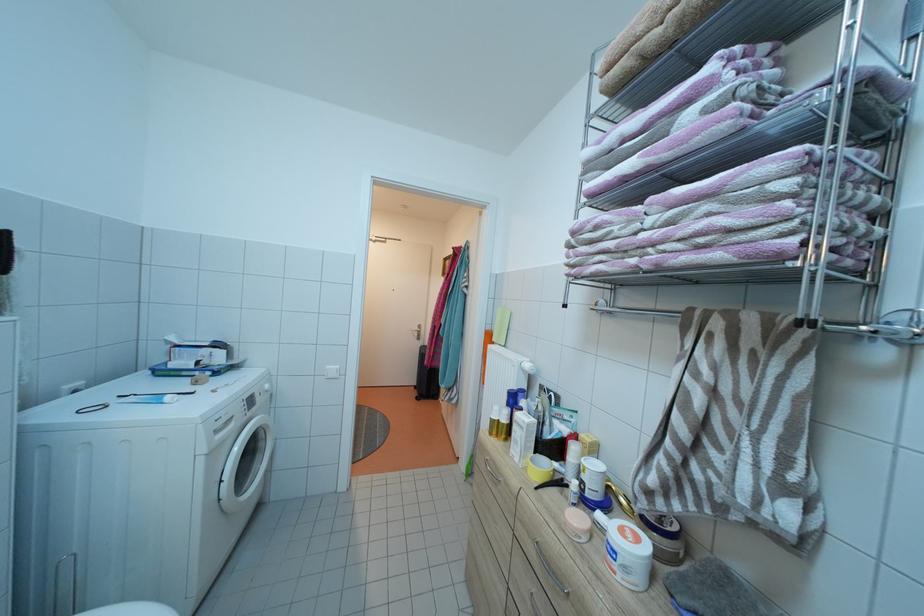
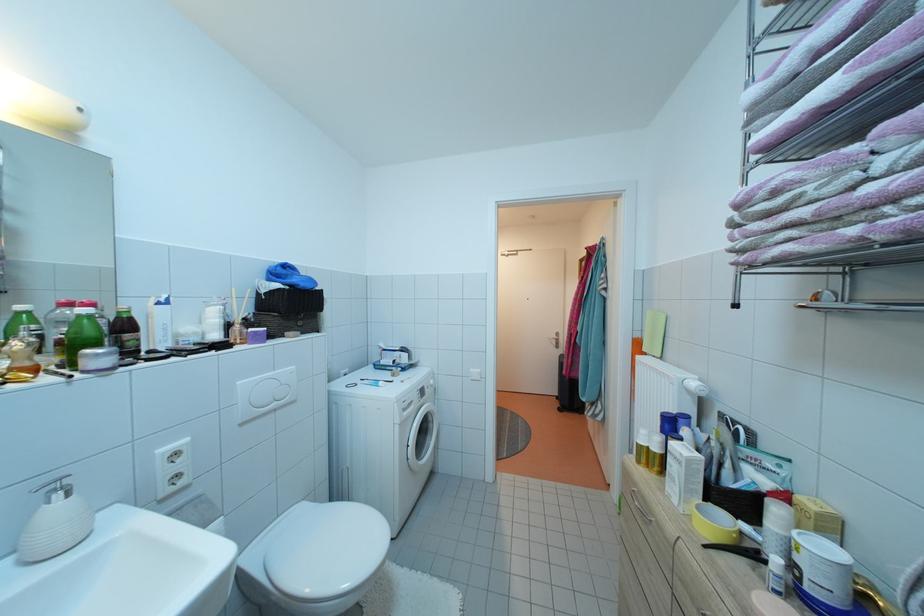
Where in the second image is the point corresponding to point (266, 405) from the first image?

(434, 397)